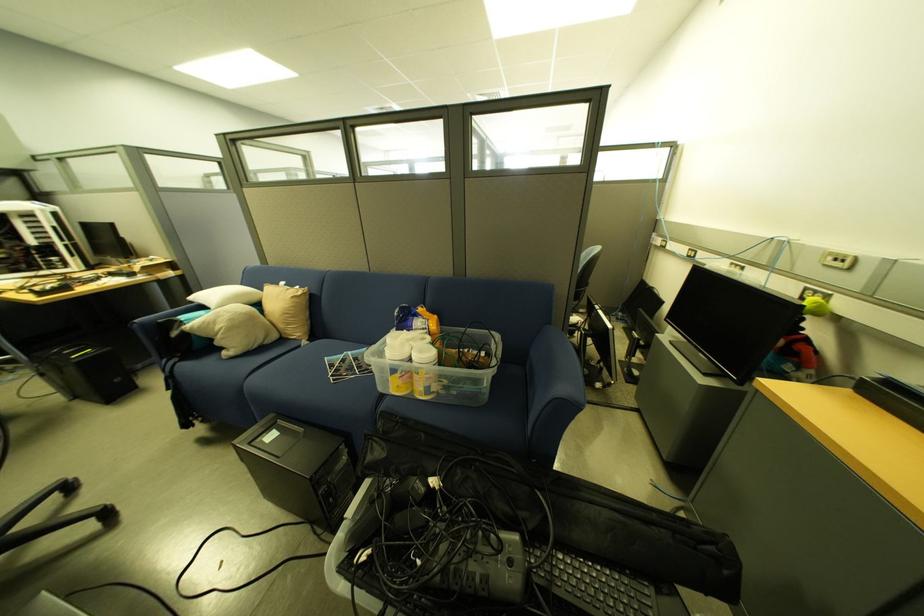
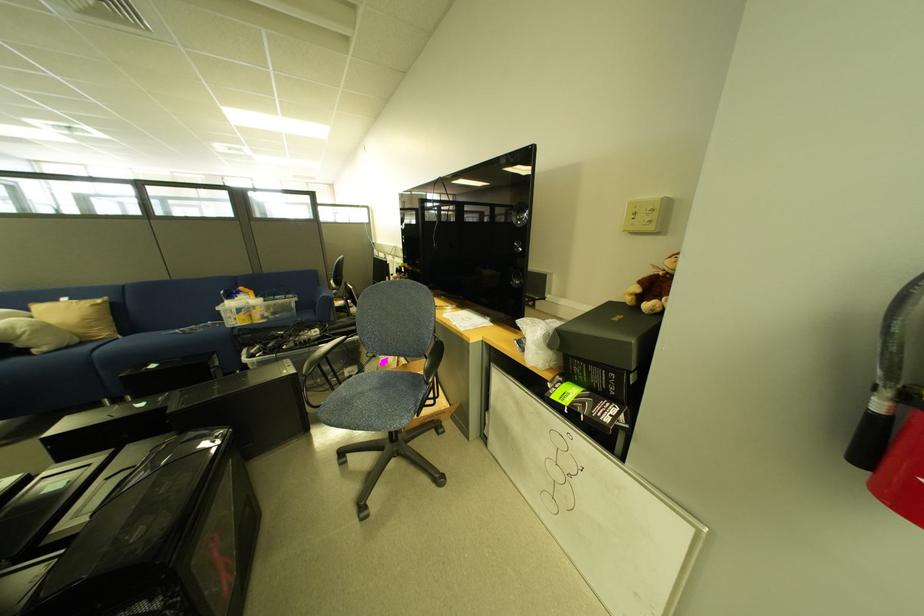
Locate, in the second image, the point that corresponds to pixel 444 355 in the first image.

(272, 302)